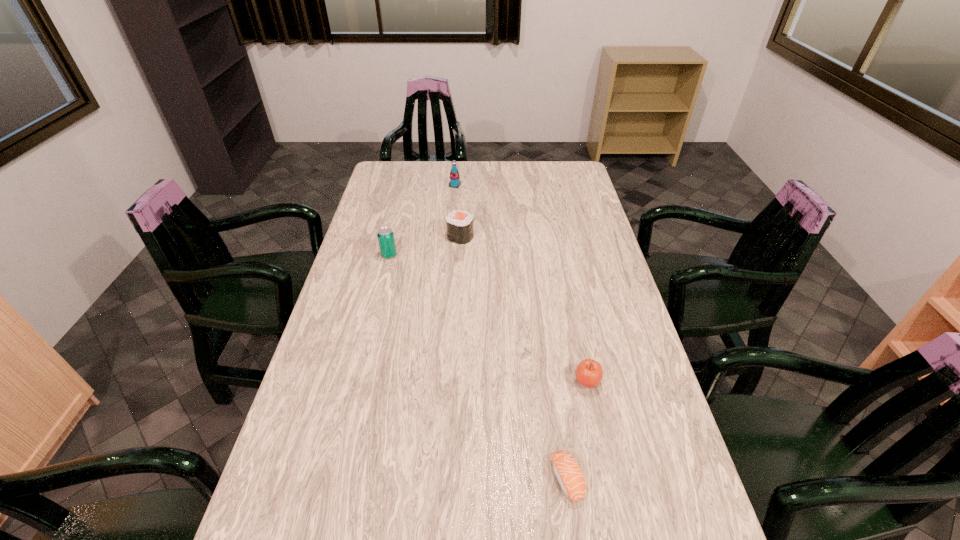
Find the location of a particular element. The width and height of the screenshot is (960, 540). vacant space at the far right corner of the desktop is located at coordinates (562, 181).

Image resolution: width=960 pixels, height=540 pixels. Find the location of `unoccupied area between the farthest object and the leftmost object`. unoccupied area between the farthest object and the leftmost object is located at coordinates (422, 220).

Locate an element on the screen. Image resolution: width=960 pixels, height=540 pixels. free space between the farthest object and the shorter sushi is located at coordinates (511, 332).

You are a GUI agent. You are given a task and a screenshot of the screen. Output one action in this format:
    pyautogui.click(x=<x>, y=<y>)
    Task: Click on the free space between the beer can and the second nearest object
    This screenshot has height=540, width=960.
    Given the screenshot: What is the action you would take?
    pyautogui.click(x=488, y=319)

Identify the location of free space that is in between the nearest object and the third nearest object. The image size is (960, 540). (478, 367).

Find the location of a particular element. The height and width of the screenshot is (540, 960). vacant space that's between the apple and the beer can is located at coordinates (488, 319).

This screenshot has height=540, width=960. What are the coordinates of `unoccupied position between the taller sushi and the leftmost object` in the screenshot? It's located at (424, 246).

The height and width of the screenshot is (540, 960). Identify the location of vacant space that's between the farthest object and the third farthest object. (422, 220).

Locate an element on the screen. free space between the third farthest object and the farthest object is located at coordinates (422, 220).

What are the coordinates of `vacant region between the second nearest object and the farthest object` in the screenshot? It's located at (521, 284).